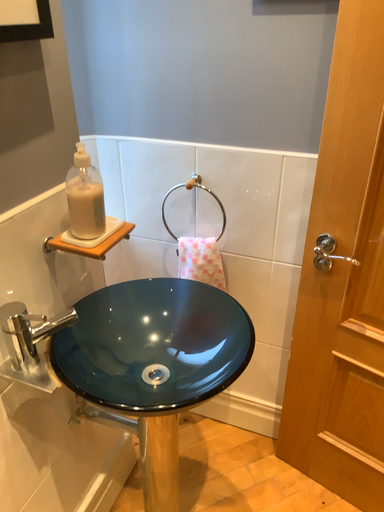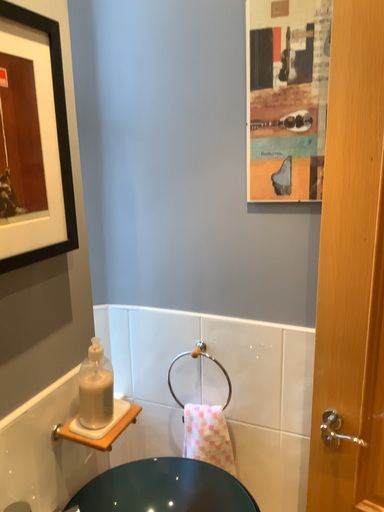
Question: How did the camera likely rotate when shooting the video?

Choices:
 (A) rotated downward
 (B) rotated upward

Answer: (B)